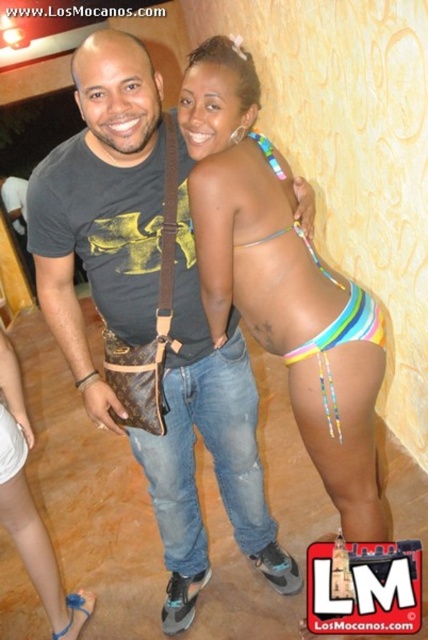
You are standing in the same room as the two people in the image. You want to walk towards the point that is closer to the camera. Which point should you head towards, point (56, 588) or point (80, 592)?

Point (56, 588) is in front of point (80, 592), so you should head towards point (56, 588) as it is closer to the camera.